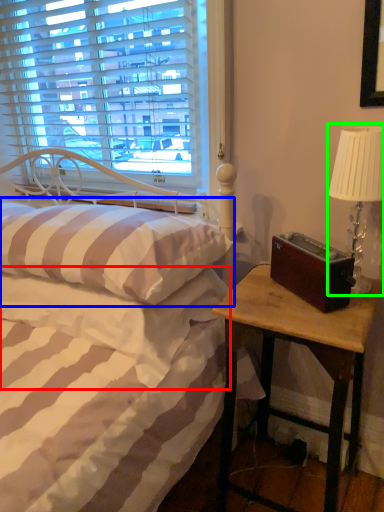
Question: Which is nearer to the mattress (highlighted by a red box)? pillow (highlighted by a blue box) or table lamp (highlighted by a green box).

Choices:
 (A) pillow
 (B) table lamp

Answer: (A)